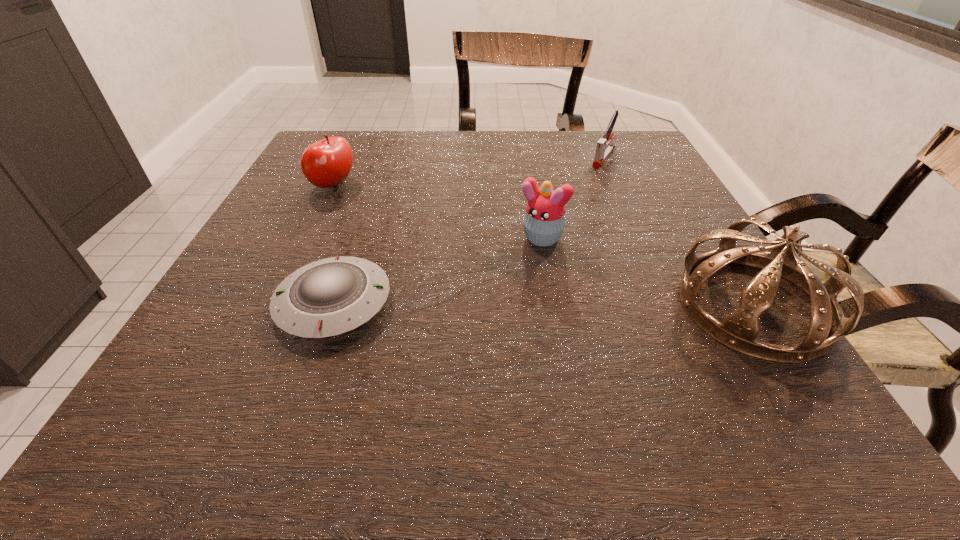
Find the location of a particular element. The height and width of the screenshot is (540, 960). vacant space that's between the third object from left to right and the apple is located at coordinates (436, 212).

Locate an element on the screen. free space between the cupcake and the tallest object is located at coordinates (646, 272).

Locate an element on the screen. free area in between the saucer and the farthest object is located at coordinates (469, 230).

Where is `free space that is in between the third object from right to left and the tiara`? The width and height of the screenshot is (960, 540). free space that is in between the third object from right to left and the tiara is located at coordinates (646, 272).

Locate an element on the screen. empty space that is in between the third object from left to right and the stapler is located at coordinates (571, 198).

Locate an element on the screen. free space between the third object from right to left and the shortest object is located at coordinates (436, 271).

Find the location of a particular element. free space between the stapler and the third object from right to left is located at coordinates coord(571,198).

Select which object is the second closest to the tallest object. Please provide its 2D coordinates. Your answer should be formatted as a tuple, i.e. [(x, y)], where the tuple contains the x and y coordinates of a point satisfying the conditions above.

[(604, 148)]

Identify which object is the nearest to the tiara. Please provide its 2D coordinates. Your answer should be formatted as a tuple, i.e. [(x, y)], where the tuple contains the x and y coordinates of a point satisfying the conditions above.

[(544, 221)]

This screenshot has height=540, width=960. Find the location of `free location that satisfies the following two spatial constraints: 1. on the back side of the saucer; 2. on the left side of the farthest object`. free location that satisfies the following two spatial constraints: 1. on the back side of the saucer; 2. on the left side of the farthest object is located at coordinates (384, 157).